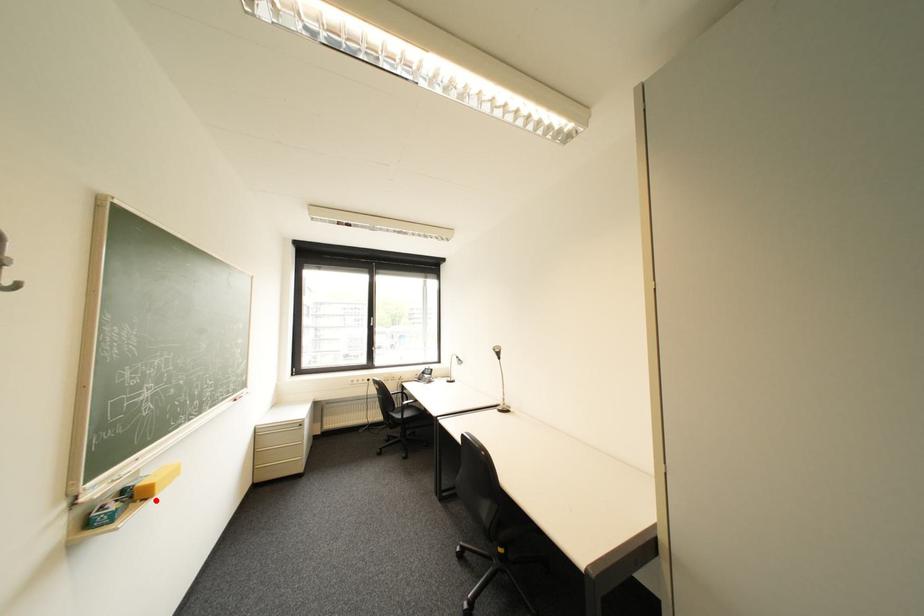
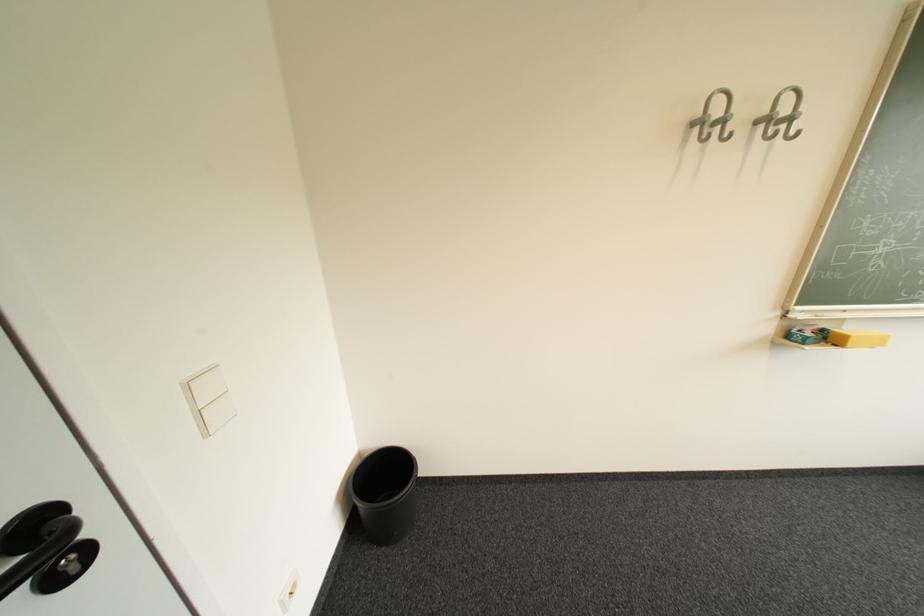
Locate, in the second image, the point that corresponds to the highlighted location in the first image.

(846, 346)